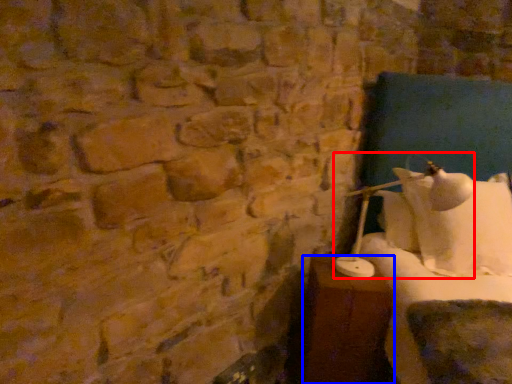
Question: Which of the following is the closest to the observer, table lamp (highlighted by a red box) or furniture (highlighted by a blue box)?

Choices:
 (A) table lamp
 (B) furniture

Answer: (A)